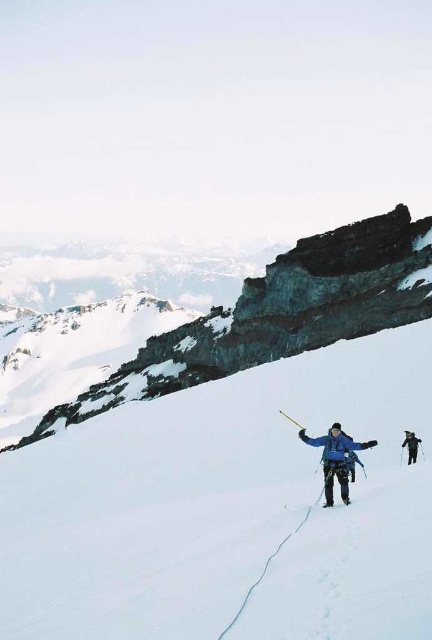
You are a mountaineer planning to place an anchor for safety. You have two options for anchor points. The first is the smooth gray rock at center, and the second is a spot 0.5 meters to the left of it. Which location would provide a more stable anchor based on the rock position?

The smooth gray rock at center is located at point (278, 316), so the anchor at the smooth gray rock at center would be more stable because it is positioned directly on the rock rather than the snow to the left.

You are a mountaineer planning to place your shiny metallic ski at center on top of the smooth gray rock at center. Based on the scene description, will the ski fit on the rock without overhanging?

The smooth gray rock at center is larger in size than the shiny metallic ski at center, so the ski will fit on the rock without overhanging.

You are a mountaineer planning to descend the slope. You see the point at coordinates (228, 508). What is the terrain like at that location?

The point at coordinates (228, 508) indicates white snow ski slope at center, so the terrain there is a snowy slope covered in white snow.